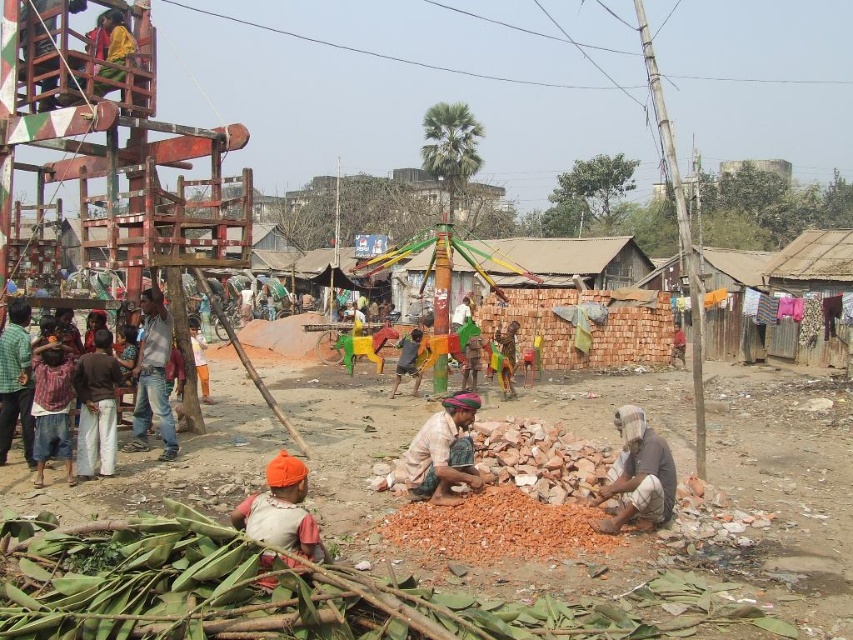
Question: Among these points, which one is farthest from the camera?

Choices:
 (A) (257, 524)
 (B) (682, 355)

Answer: (B)

Question: Which of these objects is positioned farthest from the yellow fabric at upper left?

Choices:
 (A) orange fabric at lower left
 (B) brown fabric at center
 (C) brown woven cloth at center
 (D) yellow fabric at center

Answer: (B)

Question: Does brick rubble at center appear on the right side of green checkered shirt at left?

Choices:
 (A) no
 (B) yes

Answer: (B)

Question: Is brown cotton shirt at left closer to camera compared to orange cotton pants at center?

Choices:
 (A) no
 (B) yes

Answer: (B)

Question: Does brown woven cloth at center have a smaller size compared to brown cotton pants at left?

Choices:
 (A) yes
 (B) no

Answer: (B)

Question: Which of the following is the closest to the observer?

Choices:
 (A) (64, 464)
 (B) (631, 468)

Answer: (B)